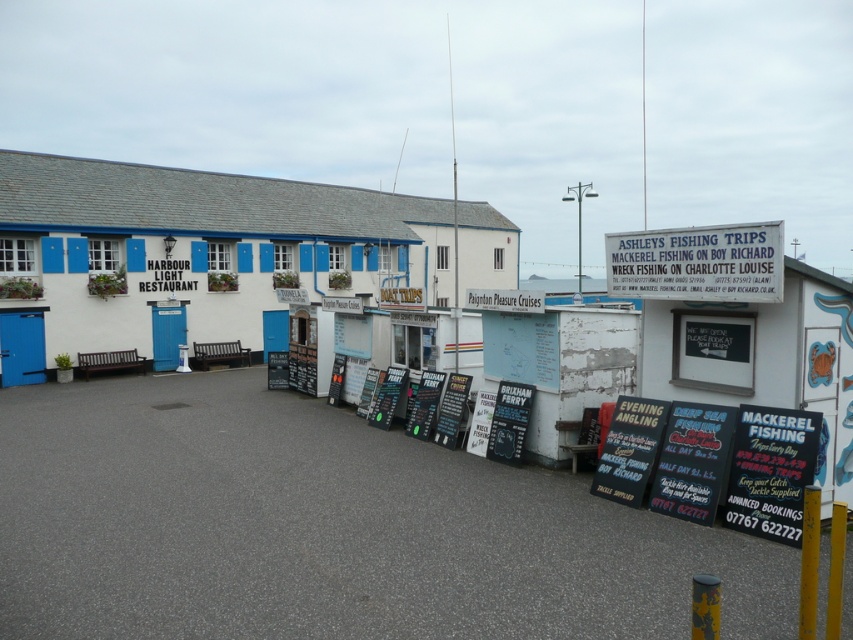
Question: Is black chalkboard sign at lower right smaller than black chalkboard at center?

Choices:
 (A) yes
 (B) no

Answer: (A)

Question: Estimate the real-world distances between objects in this image. Which object is farther from the white painted signboard at upper right?

Choices:
 (A) white painted wood building at left
 (B) black plastic sign at center
 (C) black chalkboard sign at lower right
 (D) black chalkboard at center

Answer: (A)

Question: Which of the following is the farthest from the observer?

Choices:
 (A) black plastic signboard at lower right
 (B) black chalkboard at center

Answer: (B)

Question: Is white painted signboard at upper right above black chalkboard at center?

Choices:
 (A) yes
 (B) no

Answer: (A)

Question: Which object is farther from the camera taking this photo?

Choices:
 (A) black plastic signboard at lower right
 (B) white painted signboard at upper right
 (C) white painted wood building at left

Answer: (C)

Question: Is white painted wood building at left below black chalkboard sign at lower right?

Choices:
 (A) no
 (B) yes

Answer: (A)